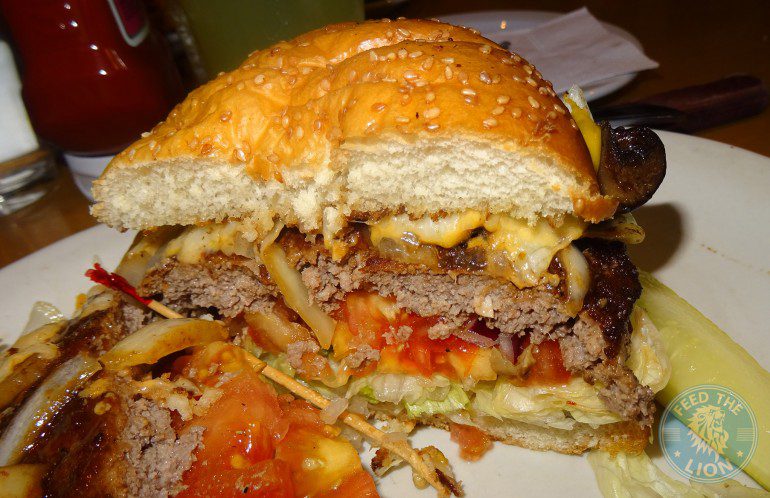
Where is `plate`? The image size is (770, 498). plate is located at coordinates (67, 274), (702, 211), (750, 325), (547, 486).